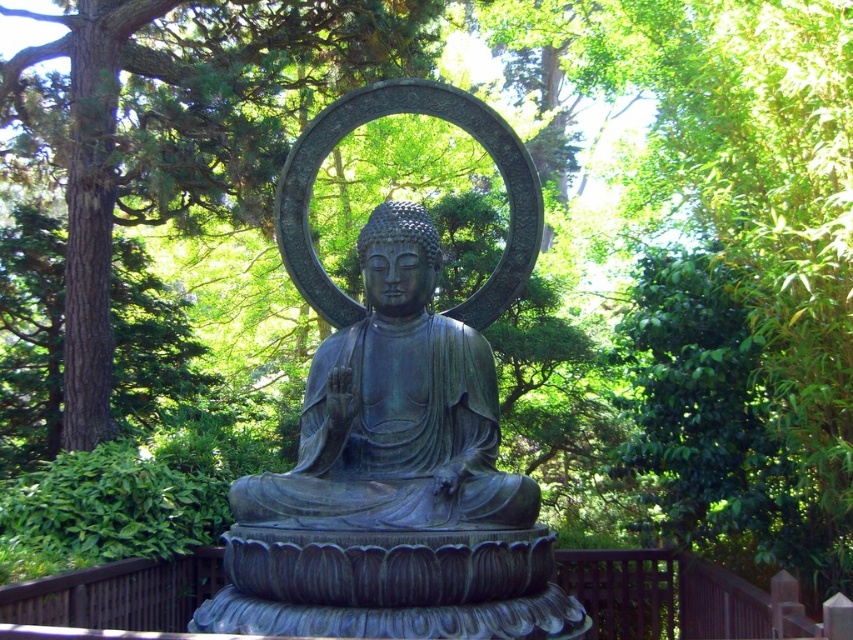
Question: Does bronze statue at center appear on the right side of green leafy tree at center?

Choices:
 (A) no
 (B) yes

Answer: (B)

Question: Which of the following is the farthest from the observer?

Choices:
 (A) (363, 108)
 (B) (433, 232)
 (C) (113, 115)

Answer: (C)

Question: Based on their relative distances, which object is farther from the green patina statue at center?

Choices:
 (A) bronze statue at center
 (B) green leafy tree at center

Answer: (B)

Question: Does bronze statue at center appear on the right side of green leafy tree at center?

Choices:
 (A) no
 (B) yes

Answer: (B)

Question: Which point appears farthest from the camera in this image?

Choices:
 (A) click(236, 506)
 (B) click(419, 340)
 (C) click(120, 22)

Answer: (C)

Question: Can you confirm if bronze statue at center is positioned to the right of green leafy tree at center?

Choices:
 (A) yes
 (B) no

Answer: (A)